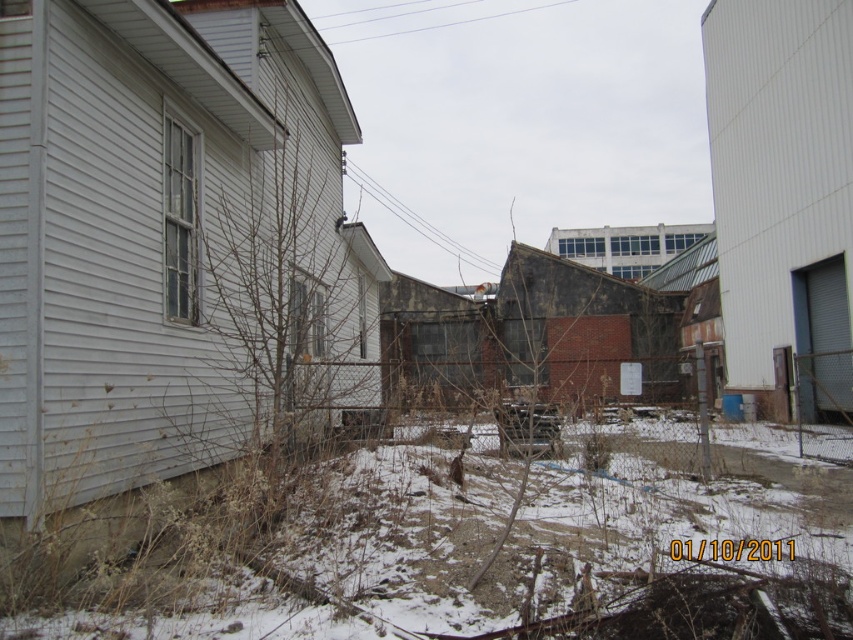
You are a photographer standing in the snowy outdoor scene. You notice two wires at the upper center of your viewfinder. Which wire is closer to you between the metallic wire at upper center and the white wire at upper center?

The metallic wire at upper center is closer to the viewer than the white wire at upper center.